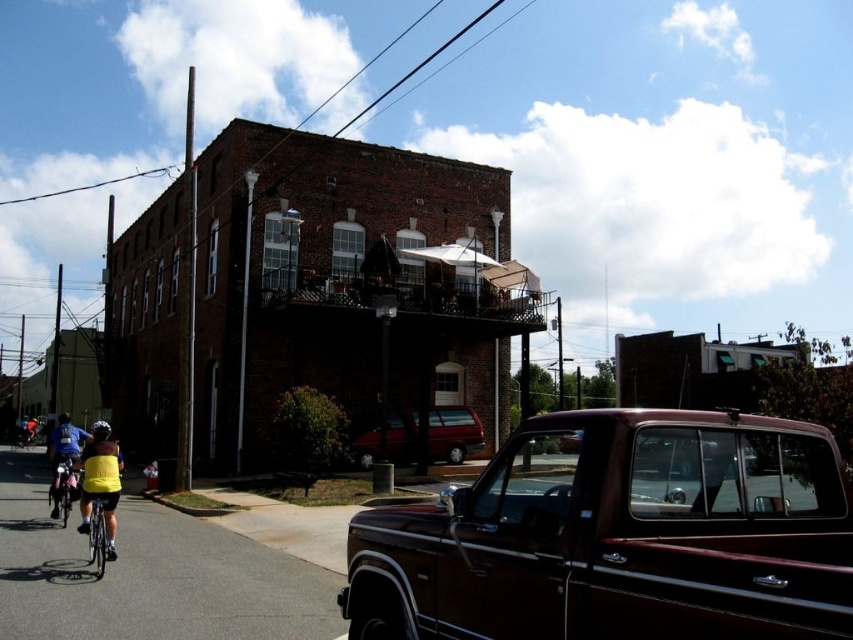
Can you confirm if metallic red minivan at center is positioned below metallic maroon truck at lower right?

Yes.

Which of these two, metallic red minivan at center or metallic maroon truck at lower right, stands taller?

Standing taller between the two is metallic red minivan at center.

Locate an element on the screen. This screenshot has width=853, height=640. metallic red minivan at center is located at coordinates (453, 433).

The width and height of the screenshot is (853, 640). Find the location of `metallic red minivan at center`. metallic red minivan at center is located at coordinates (453, 433).

Does yellow fabric at lower left appear over metallic maroon truck at lower right?

Actually, yellow fabric at lower left is below metallic maroon truck at lower right.

Image resolution: width=853 pixels, height=640 pixels. Identify the location of yellow fabric at lower left. (100, 481).

Is pink matte bicycle at lower left thinner than metallic maroon truck at lower right?

No, pink matte bicycle at lower left is not thinner than metallic maroon truck at lower right.

Image resolution: width=853 pixels, height=640 pixels. What do you see at coordinates (62, 488) in the screenshot?
I see `pink matte bicycle at lower left` at bounding box center [62, 488].

Is point (68, 512) more distant than point (572, 432)?

Yes, it is behind point (572, 432).

This screenshot has width=853, height=640. I want to click on pink matte bicycle at lower left, so click(x=62, y=488).